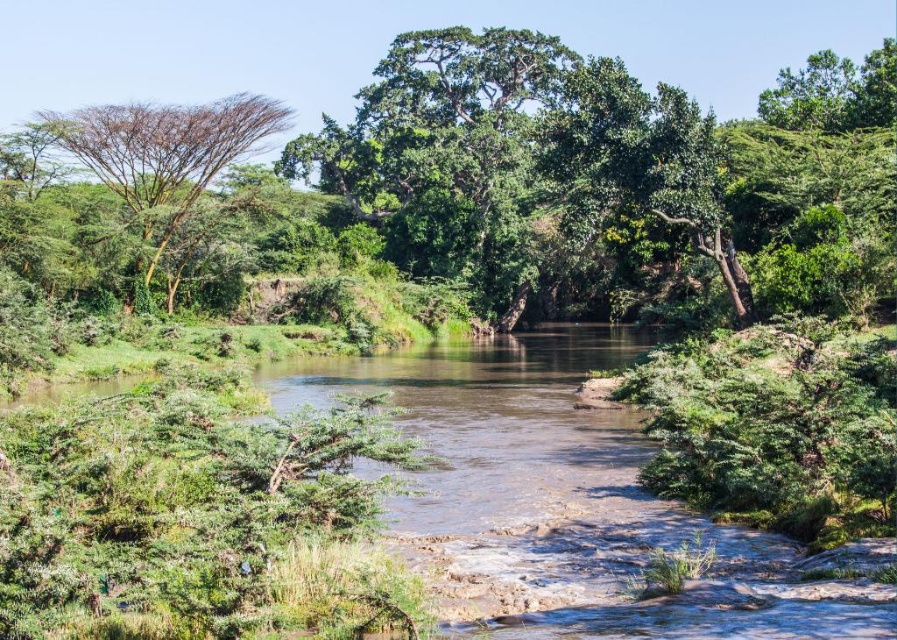
Question: Which point is closer to the camera?

Choices:
 (A) green leafy tree at center
 (B) green leafy tree at left

Answer: (A)

Question: Is green leafy tree at center positioned before green leafy tree at left?

Choices:
 (A) yes
 (B) no

Answer: (A)

Question: Is green leafy tree at center positioned behind green leafy tree at left?

Choices:
 (A) no
 (B) yes

Answer: (A)

Question: Among these points, which one is nearest to the camera?

Choices:
 (A) (155, 243)
 (B) (632, 168)

Answer: (B)

Question: In this image, where is green leafy tree at center located relative to green leafy tree at left?

Choices:
 (A) above
 (B) below

Answer: (A)